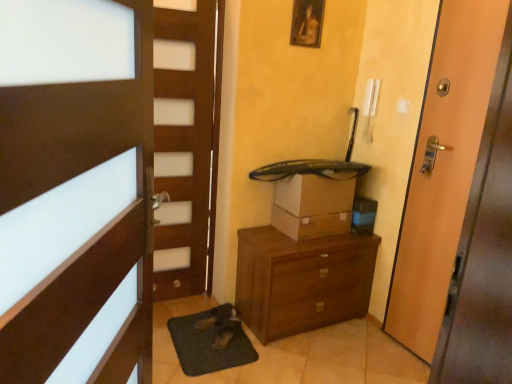
Where is `free point to the right of brown wooden chest of drawers at center`? free point to the right of brown wooden chest of drawers at center is located at coordinates (369, 344).